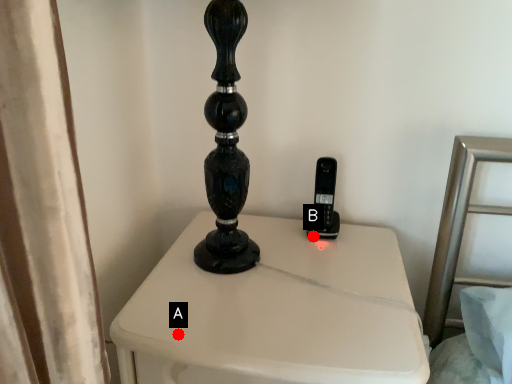
Question: Two points are circled on the image, labeled by A and B beside each circle. Which point is farther to the camera?

Choices:
 (A) A is further
 (B) B is further

Answer: (B)